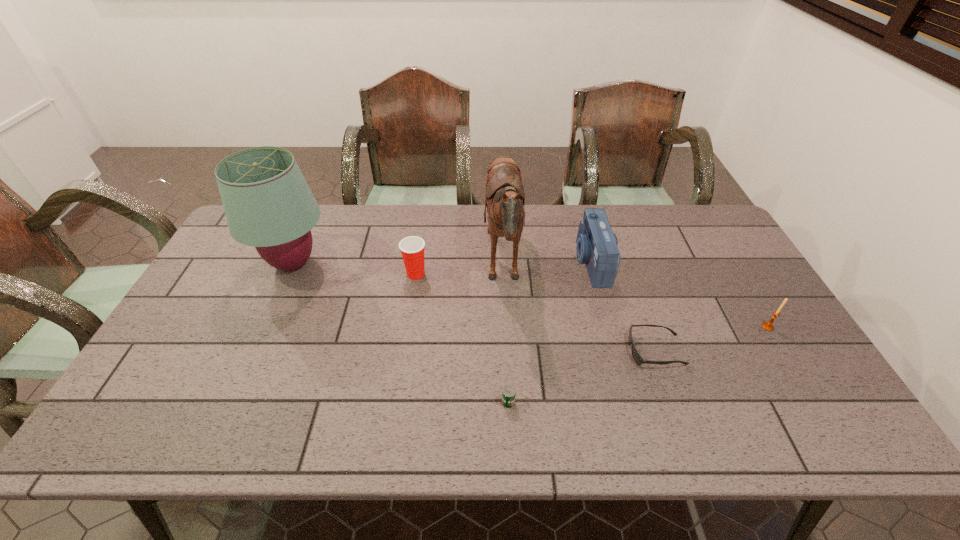
Where is `free location at the far edge of the desktop`? Image resolution: width=960 pixels, height=540 pixels. free location at the far edge of the desktop is located at coordinates (645, 222).

What are the coordinates of `vacant area at the near edge of the desktop` in the screenshot? It's located at (396, 412).

Find the location of a particular element. The image size is (960, 540). blank space at the left edge is located at coordinates (206, 289).

Identify the location of vacant space at the right edge of the desktop. (814, 399).

Locate an element on the screen. This screenshot has width=960, height=540. vacant region at the near left corner of the desktop is located at coordinates (116, 427).

Identify the location of free point between the second nearest object and the sixth object from right to left. This screenshot has height=540, width=960. (536, 312).

You are a GUI agent. You are given a task and a screenshot of the screen. Output one action in this format:
    pyautogui.click(x=<x>, y=<y>)
    Task: Click on the vacant area between the camera and the sunglasses
    This screenshot has height=540, width=960.
    Given the screenshot: What is the action you would take?
    pyautogui.click(x=623, y=306)

Where is `free space between the sixth tallest object and the leftmost object`? free space between the sixth tallest object and the leftmost object is located at coordinates (400, 333).

This screenshot has height=540, width=960. In order to click on vacant area that lies between the fifth farthest object and the saddle in this screenshot , I will do `click(636, 296)`.

Locate an element on the screen. The width and height of the screenshot is (960, 540). vacant space that's between the sunglasses and the third nearest object is located at coordinates (711, 339).